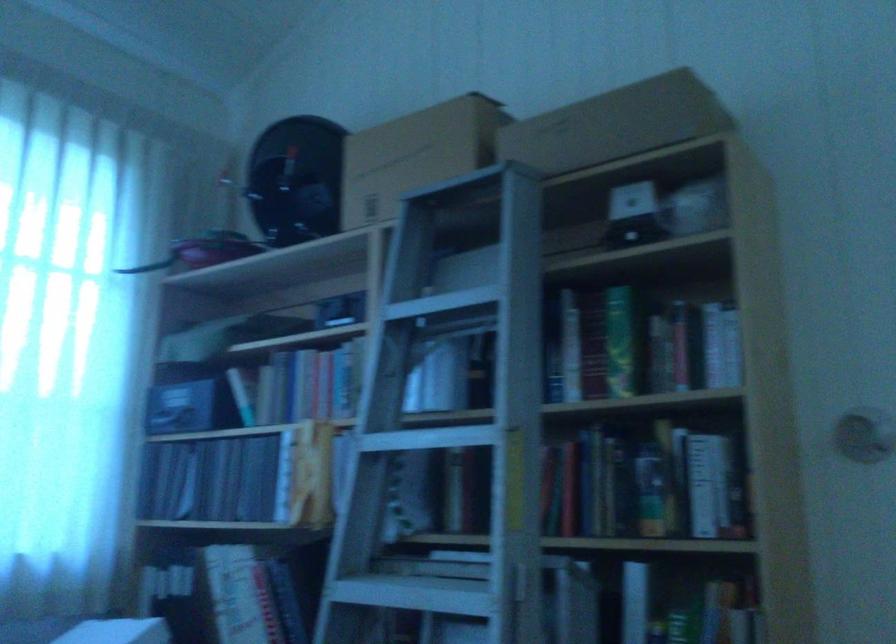
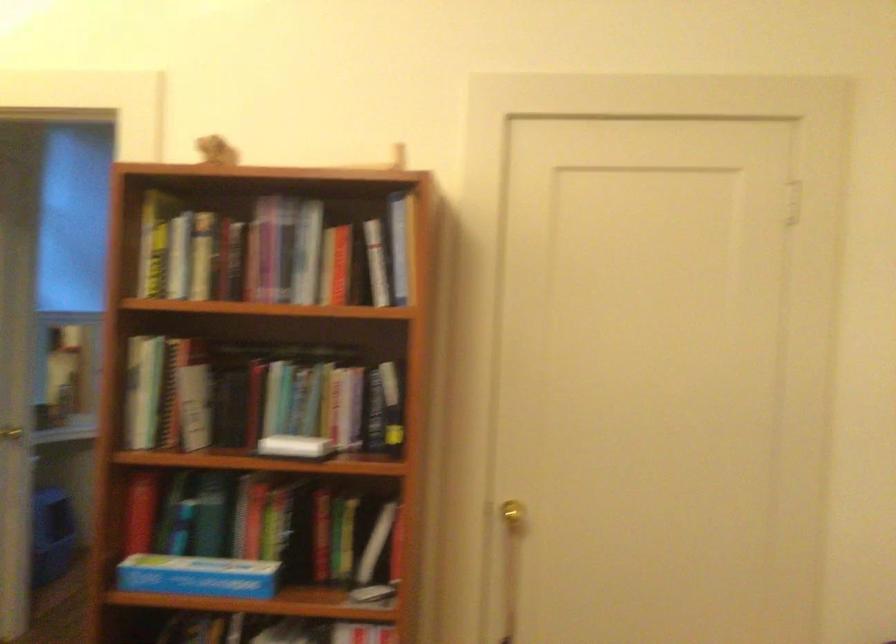
Question: I am providing you with two images of the same scene from different viewpoints. Please identify which objects are invisible in image2.

Choices:
 (A) locker handle
 (B) ladder rung
 (C) silver door knob
 (D) book

Answer: (B)